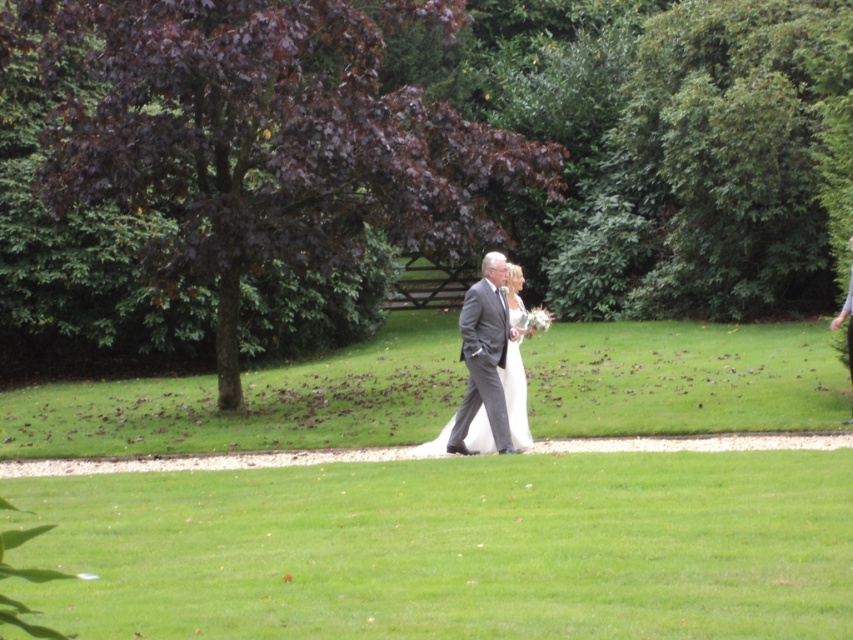
Question: Considering the relative positions of gray suit at center and white satin dress at center in the image provided, where is gray suit at center located with respect to white satin dress at center?

Choices:
 (A) right
 (B) left

Answer: (B)

Question: Which point is farther to the camera?

Choices:
 (A) (508, 445)
 (B) (573, 456)
 (C) (838, 320)

Answer: (C)

Question: Which point is farther to the camera?

Choices:
 (A) (851, 320)
 (B) (502, 253)

Answer: (A)

Question: Which object appears closest to the camera in this image?

Choices:
 (A) gray suit at center
 (B) green grass at center

Answer: (B)

Question: Can you confirm if green grass at center is thinner than white satin dress at center?

Choices:
 (A) yes
 (B) no

Answer: (B)

Question: Observing the image, what is the correct spatial positioning of green grass at center in reference to gray suit at center?

Choices:
 (A) above
 (B) below

Answer: (B)